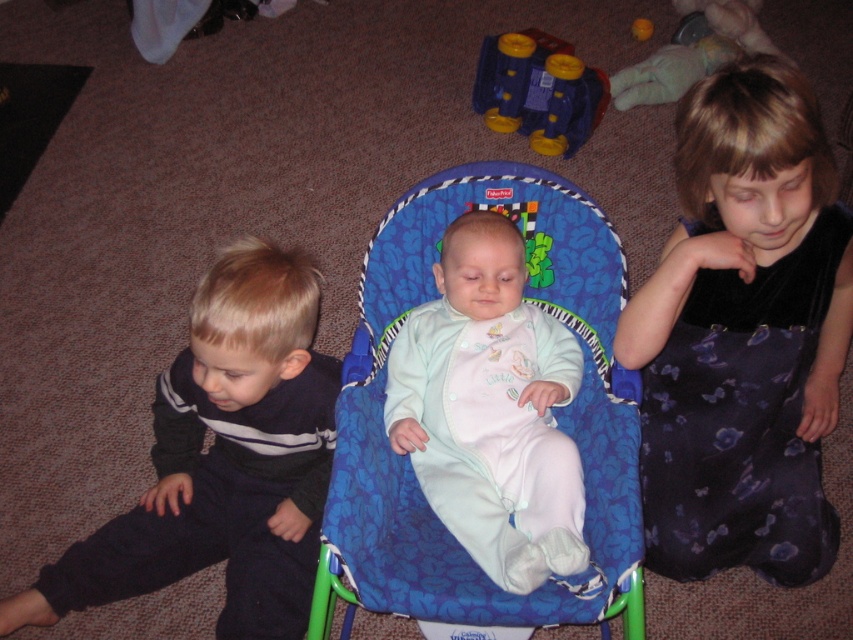
This screenshot has width=853, height=640. Find the location of `velvet black dress at right`. velvet black dress at right is located at coordinates (743, 333).

Looking at this image, who is taller, velvet black dress at right or blue plastic toy at upper center?

velvet black dress at right is taller.

Who is more distant from viewer, (695, 502) or (477, 92)?

The point (477, 92) is behind.

At what (x,y) coordinates should I click in order to perform the action: click on velvet black dress at right. Please return your answer as a coordinate pair (x, y). Image resolution: width=853 pixels, height=640 pixels. Looking at the image, I should click on (743, 333).

Does blue fabric baby chair at center appear over light blue soft fabric baby at center?

Yes.

Which is behind, point (427, 529) or point (428, 435)?

The point (428, 435) is behind.

What are the coordinates of `blue fabric baby chair at center` in the screenshot? It's located at (553, 413).

Can you confirm if blue fabric baby chair at center is shorter than blue plastic toy at upper center?

Incorrect, blue fabric baby chair at center's height does not fall short of blue plastic toy at upper center's.

Is blue fabric baby chair at center positioned before blue plastic toy at upper center?

Yes, it is.

Does point (468, 602) come in front of point (550, 147)?

Yes.

Find the location of a particular element. The height and width of the screenshot is (640, 853). blue fabric baby chair at center is located at coordinates (553, 413).